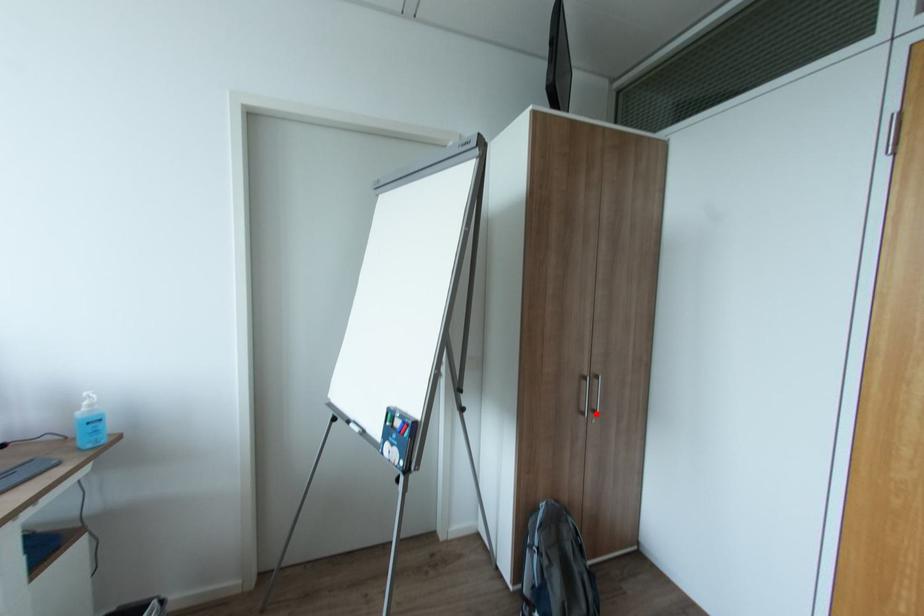
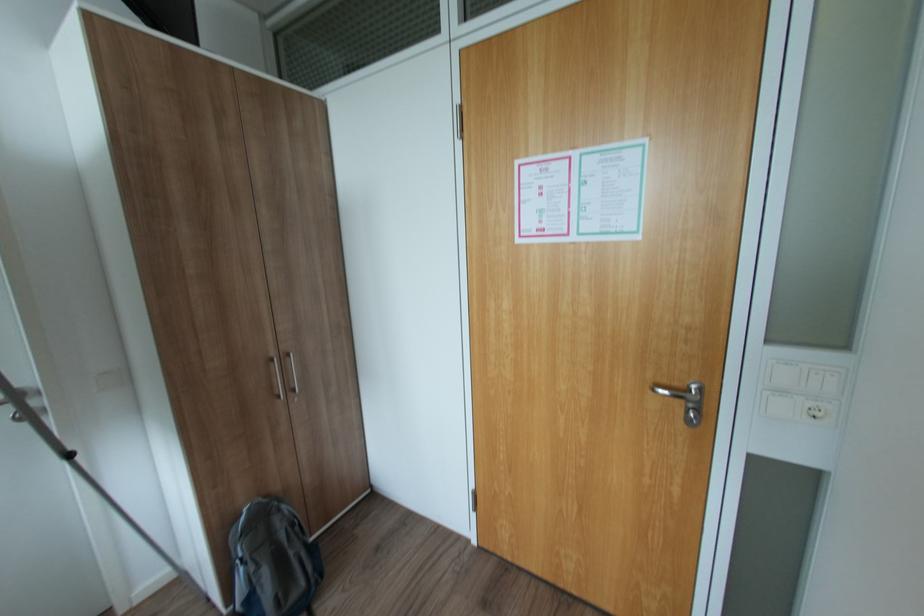
Where in the second image is the point corresponding to the highlighted location from the first image?

(297, 392)